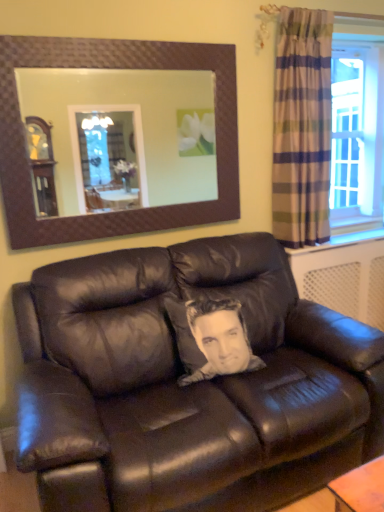
This screenshot has width=384, height=512. Find the location of `vacant area on top of brown textured mirror at upper center (from a real-world perspective)`. vacant area on top of brown textured mirror at upper center (from a real-world perspective) is located at coordinates (99, 39).